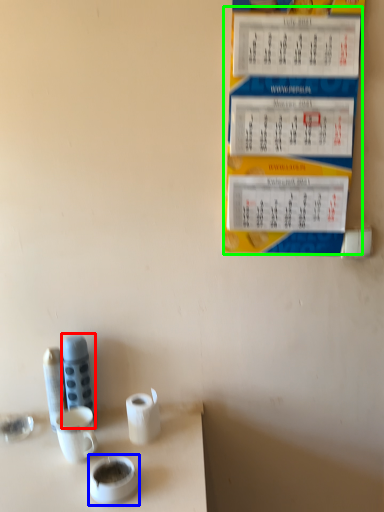
Question: Which object is positioned farthest from stationery (highlighted by a red box)? Select from teacup (highlighted by a blue box) and menu (highlighted by a green box).

Choices:
 (A) teacup
 (B) menu

Answer: (B)